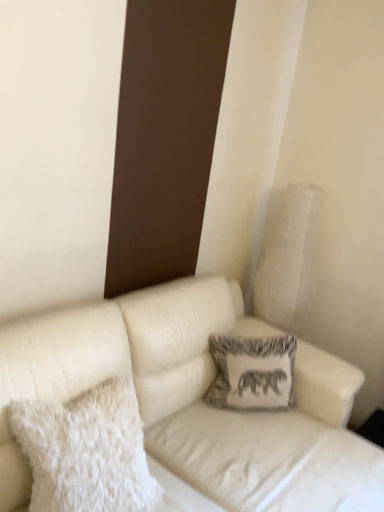
Question: Looking at their shapes, would you say printed fabric pillow at center, the 2th pillow viewed from the front, is wider or thinner than white leather couch at center?

Choices:
 (A) wide
 (B) thin

Answer: (B)

Question: From the image's perspective, is printed fabric pillow at center, the 2th pillow positioned from the back, located above or below white leather couch at center?

Choices:
 (A) below
 (B) above

Answer: (B)

Question: Which object is the closest to the white leather couch at center?

Choices:
 (A) printed fabric pillow at center, the 2th pillow viewed from the front
 (B) white fluffy pillow at left, which is the third pillow in back-to-front order
 (C) white textured pillow at upper right, acting as the 3th pillow starting from the front

Answer: (A)

Question: Estimate the real-world distances between objects in this image. Which object is closer to the printed fabric pillow at center, the second pillow from the right?

Choices:
 (A) white textured pillow at upper right, the 1th pillow positioned from the back
 (B) white fluffy pillow at left, marked as the third pillow in a right-to-left arrangement
 (C) white leather couch at center

Answer: (C)